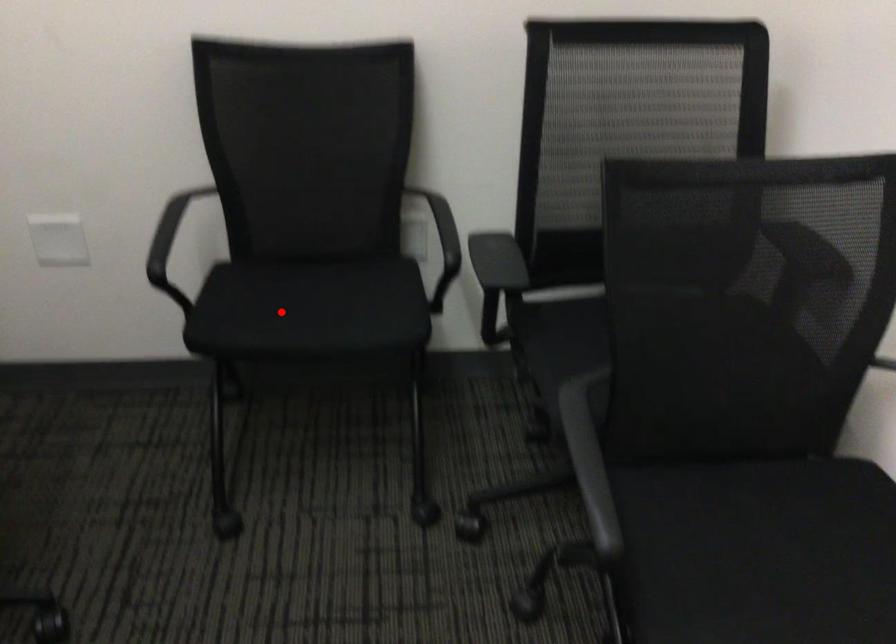
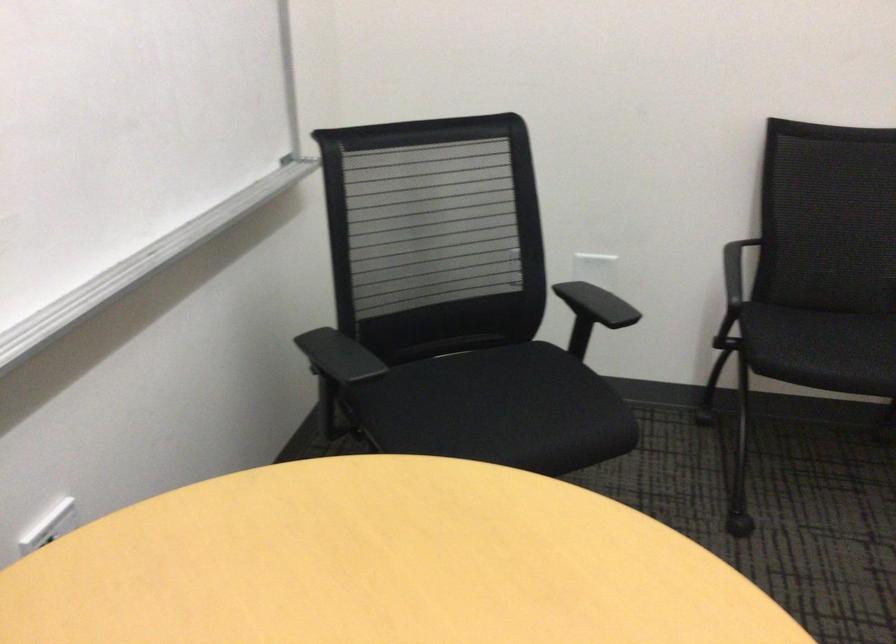
Locate, in the second image, the point that corresponds to the highlighted location in the first image.

(821, 348)